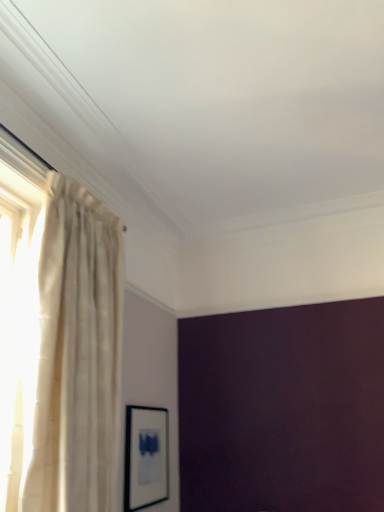
What do you see at coordinates (146, 457) in the screenshot?
I see `black matte picture frame at lower left` at bounding box center [146, 457].

At what (x,y) coordinates should I click in order to perform the action: click on black matte picture frame at lower left. Please return your answer as a coordinate pair (x, y). The width and height of the screenshot is (384, 512). Looking at the image, I should click on (146, 457).

The height and width of the screenshot is (512, 384). I want to click on black matte picture frame at lower left, so click(x=146, y=457).